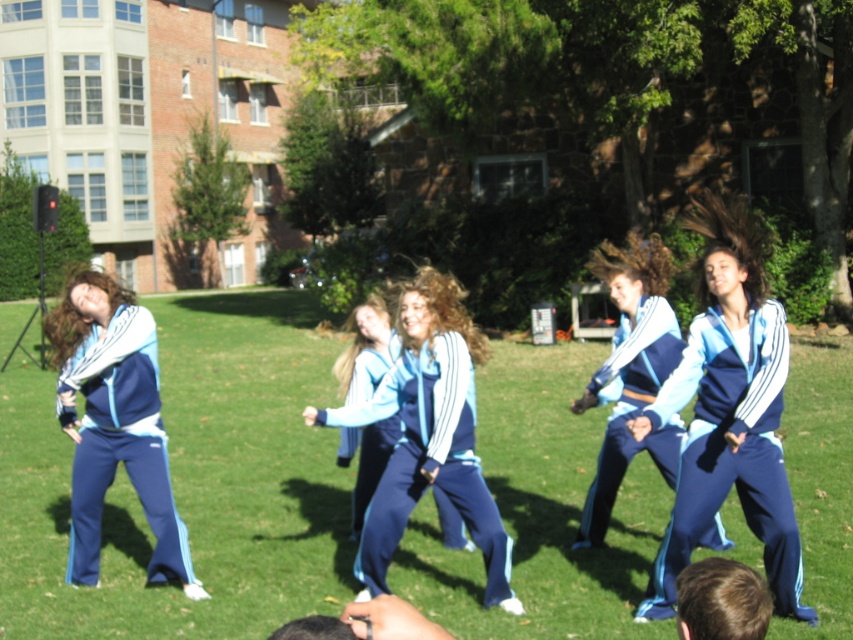
Is green grass at center closer to camera compared to matte blue tracksuit at center?

Yes, green grass at center is closer to the viewer.

Consider the image. Between green grass at center and matte blue tracksuit at center, which one has more height?

Standing taller between the two is green grass at center.

Who is more forward, [276,332] or [364,372]?

Point [364,372] is more forward.

Locate an element on the screen. The width and height of the screenshot is (853, 640). green grass at center is located at coordinates (190, 483).

What do you see at coordinates (190, 483) in the screenshot? I see `green grass at center` at bounding box center [190, 483].

Is green grass at center below blue fabric tracksuit at center?

No.

Which is behind, point (125, 476) or point (608, 397)?

Positioned behind is point (125, 476).

Find the location of a particular element. green grass at center is located at coordinates (190, 483).

Between blue track suit at center and blue fabric tracksuit at center, which one has less height?

blue fabric tracksuit at center

What do you see at coordinates (428, 433) in the screenshot? I see `blue track suit at center` at bounding box center [428, 433].

Which is in front, point (415, 432) or point (587, 497)?

Point (415, 432) is in front.

Where is `blue track suit at center`? This screenshot has height=640, width=853. blue track suit at center is located at coordinates (428, 433).